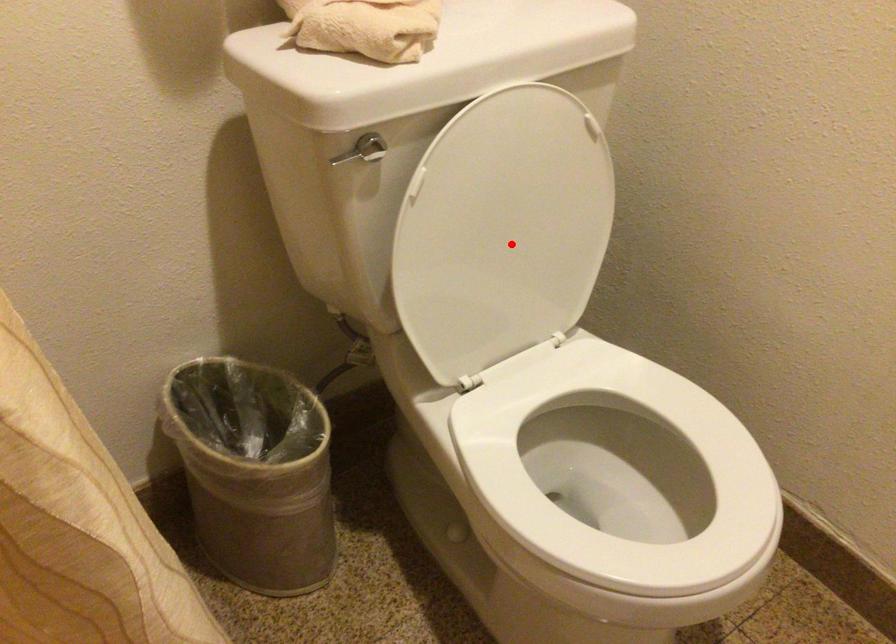
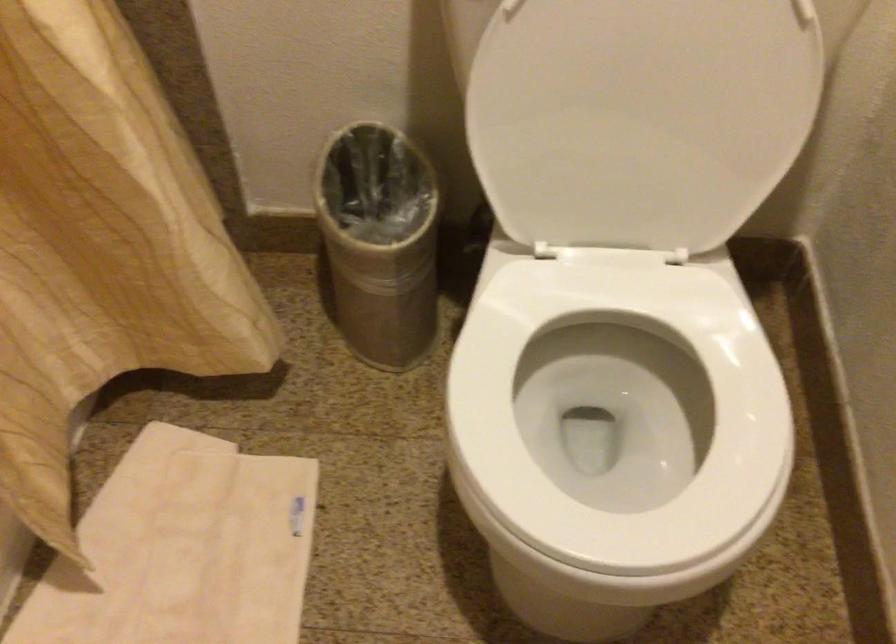
Question: A red point is marked in image1. In image2, is the corresponding 3D point closer to the camera or farther? Reply with the corresponding letter.

Choices:
 (A) The corresponding 3D point is closer.
 (B) The corresponding 3D point is farther.

Answer: (A)